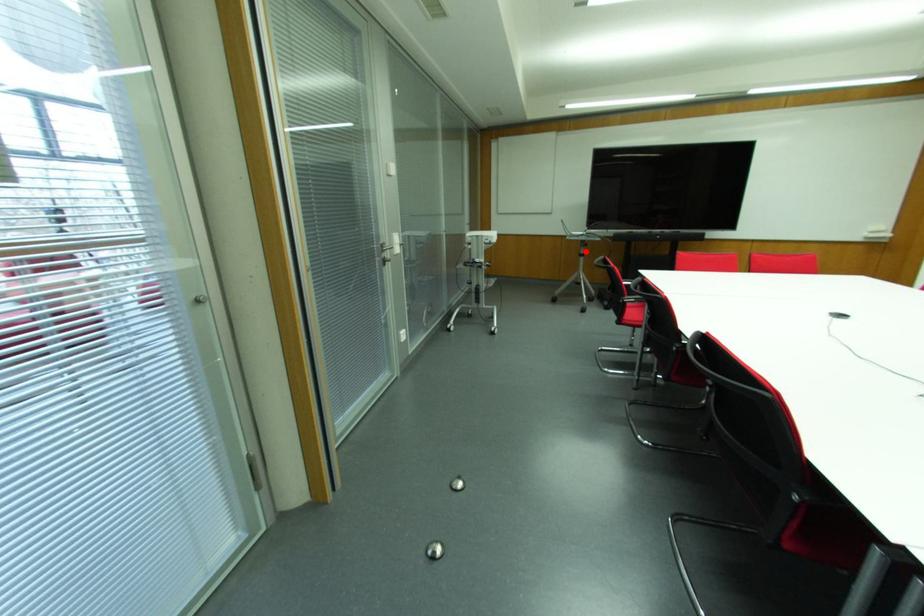
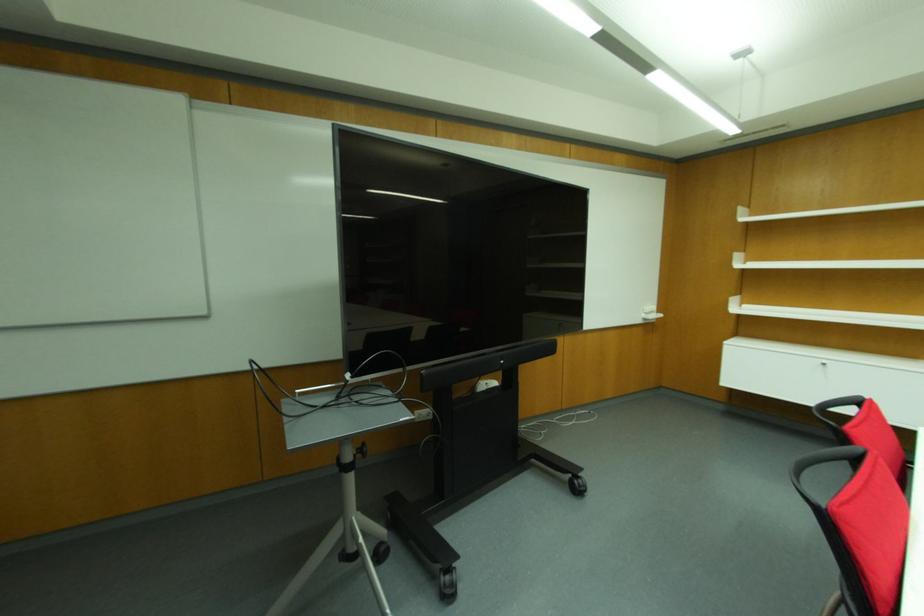
Locate, in the second image, the point that corresponds to the highlighted location in the first image.

(360, 450)